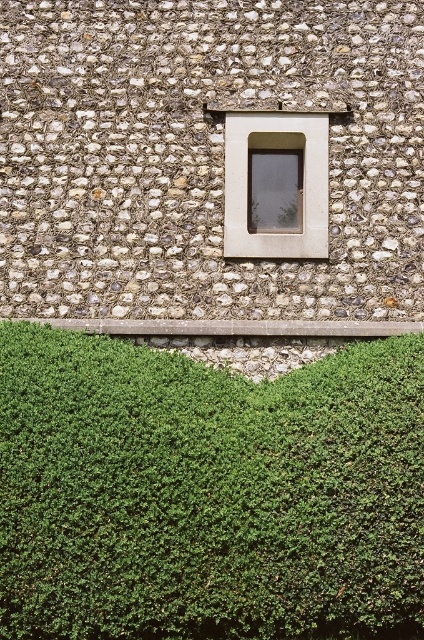
Question: Which point is farther to the camera?

Choices:
 (A) green leafy hedge at bottom
 (B) matte glass window at center

Answer: (B)

Question: Where is green leafy hedge at bottom located in relation to matte glass window at center in the image?

Choices:
 (A) right
 (B) left

Answer: (B)

Question: Can you confirm if green leafy hedge at bottom is positioned to the left of matte glass window at center?

Choices:
 (A) yes
 (B) no

Answer: (A)

Question: Which point is closer to the camera?

Choices:
 (A) green leafy hedge at bottom
 (B) matte glass window at center

Answer: (A)

Question: Which point is farther to the camera?

Choices:
 (A) matte glass window at center
 (B) green leafy hedge at bottom

Answer: (A)

Question: Is green leafy hedge at bottom to the right of matte glass window at center from the viewer's perspective?

Choices:
 (A) no
 (B) yes

Answer: (A)